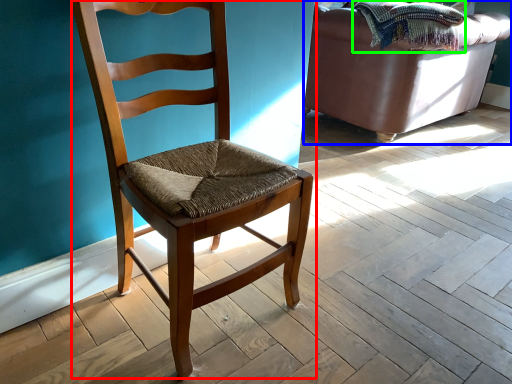
Question: Which object is the farthest from chair (highlighted by a red box)? Choose among these: studio couch (highlighted by a blue box) or blanket (highlighted by a green box).

Choices:
 (A) studio couch
 (B) blanket

Answer: (A)